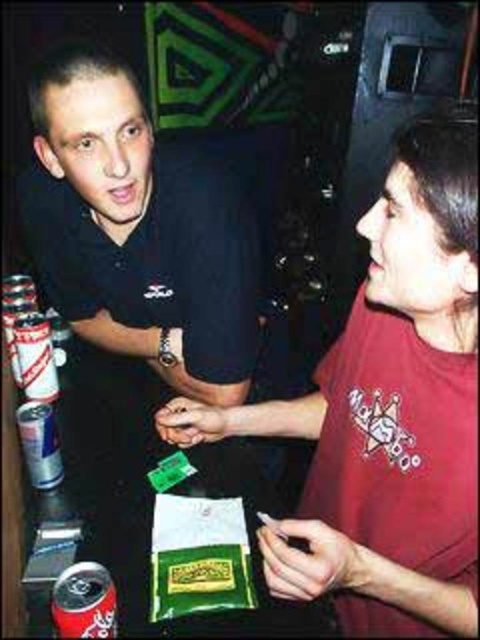
Question: Is red matte soda can at lower left smaller than silver metallic can at left?

Choices:
 (A) no
 (B) yes

Answer: (B)

Question: Which of the following is the farthest from the observer?

Choices:
 (A) white cardboard can at left
 (B) silver metallic can at left
 (C) red matte shirt at right

Answer: (A)

Question: Which of the following is the closest to the observer?

Choices:
 (A) red matte shirt at right
 (B) white cardboard can at left
 (C) red matte soda can at lower left
 (D) silver metallic can at left

Answer: (A)

Question: Which of the following is the farthest from the observer?

Choices:
 (A) red matte shirt at right
 (B) silver metallic can at left
 (C) red matte soda can at lower left
 (D) white cardboard can at left

Answer: (D)

Question: Is white cardboard can at left further to camera compared to silver metallic can at left?

Choices:
 (A) yes
 (B) no

Answer: (A)

Question: Does red matte soda can at lower left have a lesser width compared to white cardboard can at left?

Choices:
 (A) yes
 (B) no

Answer: (A)